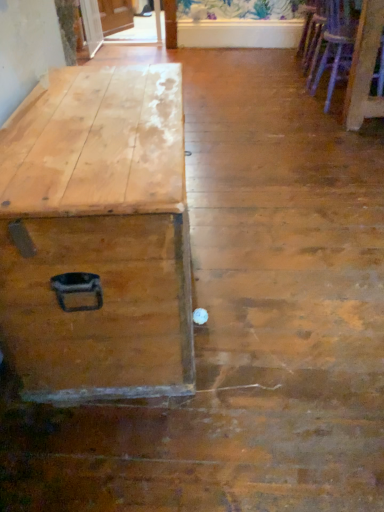
I want to click on natural wood trunk at left, so click(99, 236).

Would you say natural wood trunk at left is to the left or to the right of wooden armchair at upper right, the first armchair viewed from the top, in the picture?

natural wood trunk at left is positioned on wooden armchair at upper right, the first armchair viewed from the top,'s left side.

From their relative heights in the image, would you say natural wood trunk at left is taller or shorter than wooden armchair at upper right, the second armchair when ordered from bottom to top?

Considering their sizes, natural wood trunk at left has more height than wooden armchair at upper right, the second armchair when ordered from bottom to top.

How many degrees apart are the facing directions of natural wood trunk at left and wooden armchair at upper right, the second armchair when ordered from bottom to top?

The facing directions of natural wood trunk at left and wooden armchair at upper right, the second armchair when ordered from bottom to top, are 0.17 degrees apart.

Could you tell me if natural wood trunk at left is facing wooden armchair at upper right, the first armchair viewed from the top?

No, natural wood trunk at left is not facing towards wooden armchair at upper right, the first armchair viewed from the top.

Considering the relative sizes of wooden armchair at upper right, the 1th armchair from the back, and wooden armchair at right, placed as the first armchair when sorted from front to back, in the image provided, is wooden armchair at upper right, the 1th armchair from the back, smaller than wooden armchair at right, placed as the first armchair when sorted from front to back,?

Indeed, wooden armchair at upper right, the 1th armchair from the back, has a smaller size compared to wooden armchair at right, placed as the first armchair when sorted from front to back.

Considering the positions of objects wooden armchair at upper right, the 1th armchair from the back, and wooden armchair at right, placed as the first armchair when sorted from front to back, in the image provided, who is in front, wooden armchair at upper right, the 1th armchair from the back, or wooden armchair at right, placed as the first armchair when sorted from front to back,?

wooden armchair at right, placed as the first armchair when sorted from front to back, is more forward.

From a real-world perspective, is wooden armchair at upper right, the second armchair when ordered from bottom to top, positioned under wooden armchair at right, placed as the first armchair when sorted from front to back, based on gravity?

Correct, in the physical world, wooden armchair at upper right, the second armchair when ordered from bottom to top, is lower than wooden armchair at right, placed as the first armchair when sorted from front to back.

Considering the sizes of objects wooden armchair at upper right, the 2th armchair when ordered from front to back, and wooden armchair at right, arranged as the 2th armchair when viewed from the top, in the image provided, who is thinner, wooden armchair at upper right, the 2th armchair when ordered from front to back, or wooden armchair at right, arranged as the 2th armchair when viewed from the top,?

wooden armchair at upper right, the 2th armchair when ordered from front to back, is thinner.

In terms of size, does wooden armchair at right, positioned as the first armchair in bottom-to-top order, appear bigger or smaller than natural wood trunk at left?

wooden armchair at right, positioned as the first armchair in bottom-to-top order, is smaller than natural wood trunk at left.

Considering the positions of point (347, 47) and point (24, 128), is point (347, 47) closer or farther from the camera than point (24, 128)?

Point (347, 47) is positioned farther from the camera compared to point (24, 128).

Considering the relative sizes of wooden armchair at right, which is the second armchair in back-to-front order, and natural wood trunk at left in the image provided, is wooden armchair at right, which is the second armchair in back-to-front order, thinner than natural wood trunk at left?

No.

How many degrees apart are the facing directions of wooden armchair at right, placed as the first armchair when sorted from front to back, and wooden armchair at upper right, the 1th armchair from the back?

There is a 5.01-degree angle between the facing directions of wooden armchair at right, placed as the first armchair when sorted from front to back, and wooden armchair at upper right, the 1th armchair from the back.

Who is shorter, wooden armchair at right, which is the second armchair in back-to-front order, or wooden armchair at upper right, the 1th armchair from the back?

wooden armchair at upper right, the 1th armchair from the back.

Locate an element on the screen. armchair on the right side of wooden armchair at upper right, the first armchair viewed from the top is located at coordinates (335, 49).

Considering the sizes of wooden armchair at right, placed as the first armchair when sorted from front to back, and wooden armchair at upper right, the 1th armchair from the back, in the image, is wooden armchair at right, placed as the first armchair when sorted from front to back, bigger or smaller than wooden armchair at upper right, the 1th armchair from the back,?

Clearly, wooden armchair at right, placed as the first armchair when sorted from front to back, is larger in size than wooden armchair at upper right, the 1th armchair from the back.

Who is shorter, natural wood trunk at left or wooden armchair at right, placed as the first armchair when sorted from front to back?

Standing shorter between the two is natural wood trunk at left.

Would you say natural wood trunk at left is a long distance from wooden armchair at right, placed as the first armchair when sorted from front to back?

Yes, natural wood trunk at left and wooden armchair at right, placed as the first armchair when sorted from front to back, are quite far apart.

Is point (144, 250) positioned before point (332, 26)?

Yes, point (144, 250) is in front of point (332, 26).

How distant is wooden armchair at upper right, the first armchair viewed from the top, from natural wood trunk at left?

A distance of 6.94 feet exists between wooden armchair at upper right, the first armchair viewed from the top, and natural wood trunk at left.

Is wooden armchair at upper right, the first armchair viewed from the top, facing away from natural wood trunk at left?

wooden armchair at upper right, the first armchair viewed from the top, does not have its back to natural wood trunk at left.

Can we say wooden armchair at upper right, the second armchair when ordered from bottom to top, lies outside natural wood trunk at left?

Yes, wooden armchair at upper right, the second armchair when ordered from bottom to top, is located beyond the bounds of natural wood trunk at left.

From the image's perspective, who appears lower, wooden armchair at upper right, the first armchair viewed from the top, or natural wood trunk at left?

natural wood trunk at left appears lower in the image.

This screenshot has width=384, height=512. In order to click on armchair below the natural wood trunk at left (from a real-world perspective) in this screenshot , I will do `click(317, 37)`.

Find the location of `armchair in front of the wooden armchair at upper right, the second armchair when ordered from bottom to top`. armchair in front of the wooden armchair at upper right, the second armchair when ordered from bottom to top is located at coordinates (335, 49).

From the image, which object appears to be farther from natural wood trunk at left, wooden armchair at right, which is the second armchair in back-to-front order, or wooden armchair at upper right, the 1th armchair from the back?

Based on the image, wooden armchair at upper right, the 1th armchair from the back, appears to be further to natural wood trunk at left.

Looking at the image, which one is located further to wooden armchair at right, which is the second armchair in back-to-front order, wooden armchair at upper right, the first armchair viewed from the top, or natural wood trunk at left?

natural wood trunk at left lies further to wooden armchair at right, which is the second armchair in back-to-front order, than the other object.

Estimate the real-world distances between objects in this image. Which object is further from wooden armchair at right, which is the second armchair in back-to-front order, natural wood trunk at left or wooden armchair at upper right, the first armchair viewed from the top?

natural wood trunk at left lies further to wooden armchair at right, which is the second armchair in back-to-front order, than the other object.

Estimate the real-world distances between objects in this image. Which object is closer to wooden armchair at upper right, the 2th armchair when ordered from front to back, natural wood trunk at left or wooden armchair at right, positioned as the first armchair in bottom-to-top order?

wooden armchair at right, positioned as the first armchair in bottom-to-top order, is positioned closer to the anchor wooden armchair at upper right, the 2th armchair when ordered from front to back.

From the image, which object appears to be nearer to natural wood trunk at left, wooden armchair at upper right, the second armchair when ordered from bottom to top, or wooden armchair at right, placed as the first armchair when sorted from front to back?

Based on the image, wooden armchair at right, placed as the first armchair when sorted from front to back, appears to be nearer to natural wood trunk at left.

When comparing their distances from wooden armchair at upper right, the second armchair when ordered from bottom to top, does wooden armchair at right, which is the second armchair in back-to-front order, or natural wood trunk at left seem further?

natural wood trunk at left is positioned further to the anchor wooden armchair at upper right, the second armchair when ordered from bottom to top.

The image size is (384, 512). Find the location of `armchair positioned between natural wood trunk at left and wooden armchair at upper right, the 2th armchair when ordered from front to back, from near to far`. armchair positioned between natural wood trunk at left and wooden armchair at upper right, the 2th armchair when ordered from front to back, from near to far is located at coordinates (335, 49).